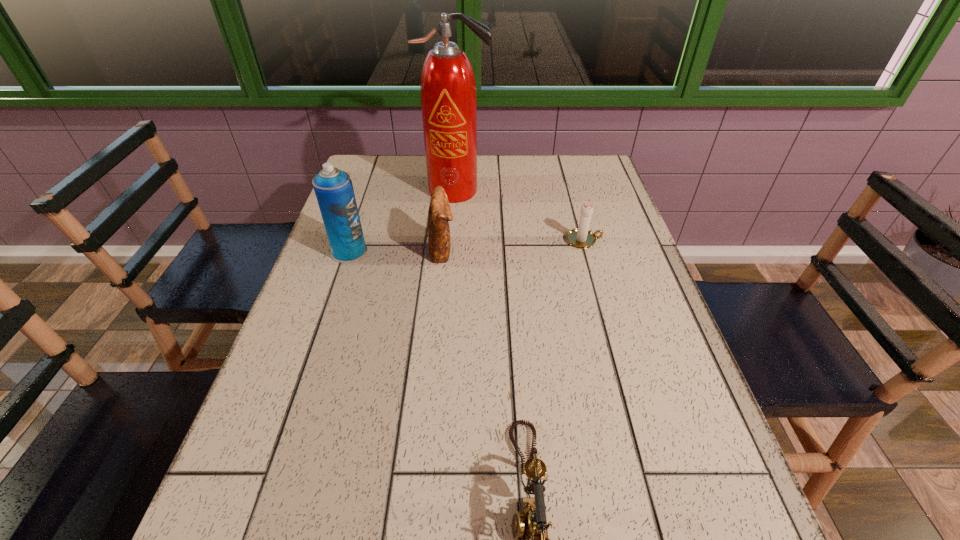
In order to click on the farthest object in this screenshot , I will do `click(448, 90)`.

You are a GUI agent. You are given a task and a screenshot of the screen. Output one action in this format:
    pyautogui.click(x=<x>, y=<y>)
    Task: Click on the tallest object
    Image resolution: width=960 pixels, height=540 pixels.
    Given the screenshot: What is the action you would take?
    pyautogui.click(x=448, y=90)

You are a GUI agent. You are given a task and a screenshot of the screen. Output one action in this format:
    pyautogui.click(x=<x>, y=<y>)
    Task: Click on the aerosol can
    The image size is (960, 540).
    Given the screenshot: What is the action you would take?
    tap(334, 191)

The image size is (960, 540). What are the coordinates of `the second tallest object` in the screenshot? It's located at (334, 191).

You are a GUI agent. You are given a task and a screenshot of the screen. Output one action in this format:
    pyautogui.click(x=<x>, y=<y>)
    Task: Click on the third shortest object
    
    Given the screenshot: What is the action you would take?
    pyautogui.click(x=439, y=214)

Where is `the rightmost object`? the rightmost object is located at coordinates (581, 237).

Image resolution: width=960 pixels, height=540 pixels. I want to click on vacant space situated on the back of the tallest object, so click(459, 161).

Locate an element on the screen. free spot located on the right of the leftmost object is located at coordinates (492, 252).

In order to click on free space located on the open side of the clutch bag in this screenshot , I will do `click(578, 249)`.

I want to click on vacant space located on the handle side of the rightmost object, so click(x=630, y=240).